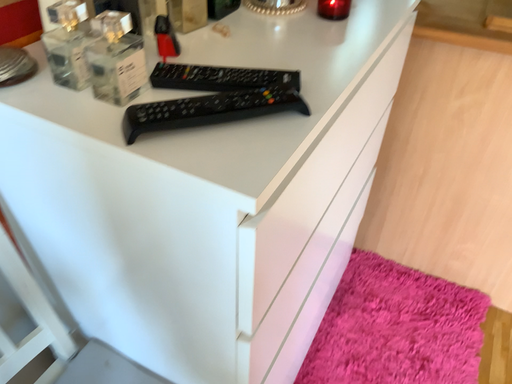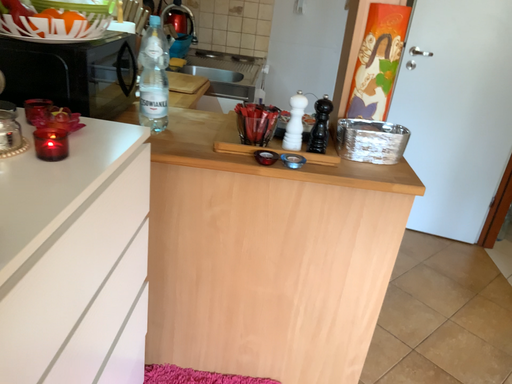
Question: How did the camera likely rotate when shooting the video?

Choices:
 (A) rotated downward
 (B) rotated upward

Answer: (B)